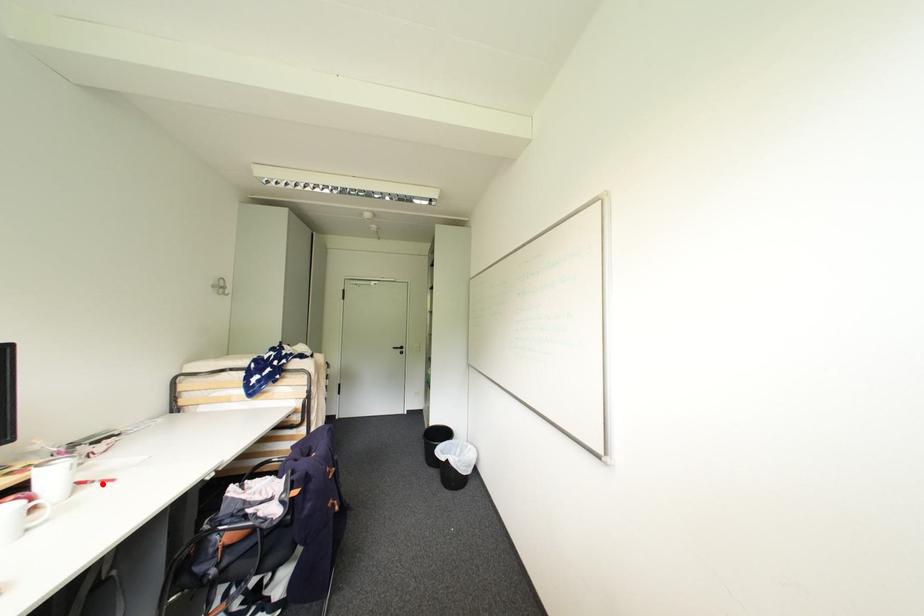
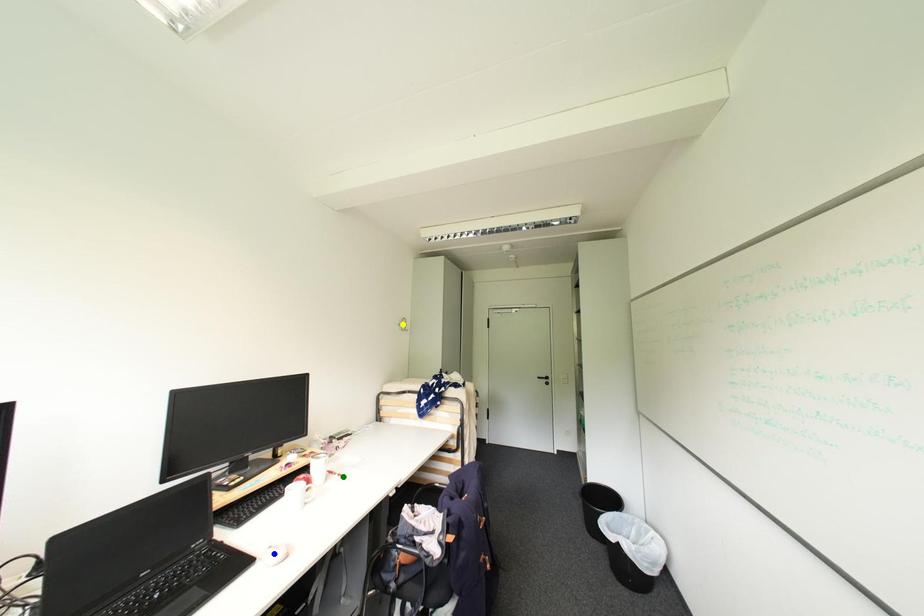
Question: I am providing you with two images of the same scene from different viewpoints. A red point is marked on the first image. You are given multiple points on the second image. Which spot in image 2 lines up with the point in image 1?

Choices:
 (A) green point
 (B) yellow point
 (C) blue point

Answer: (A)